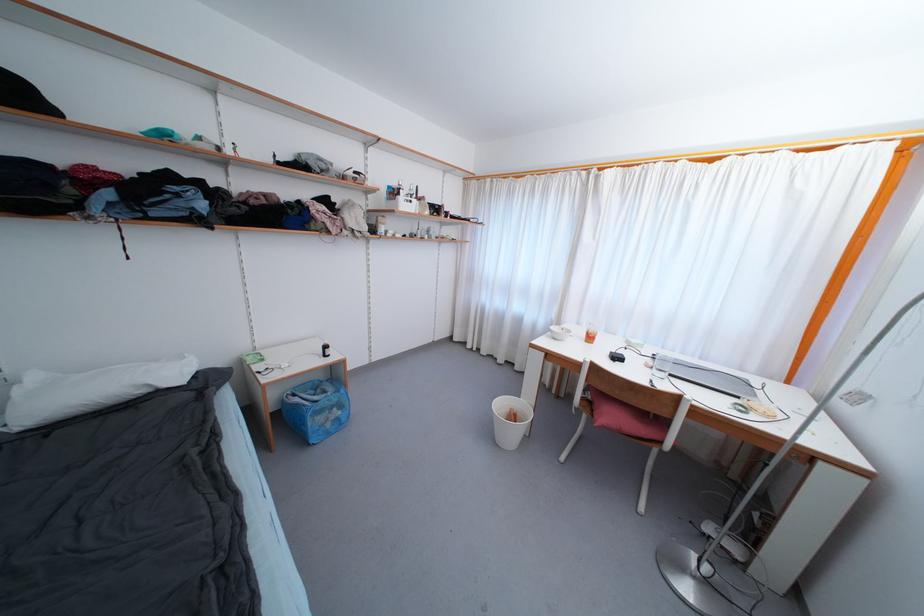
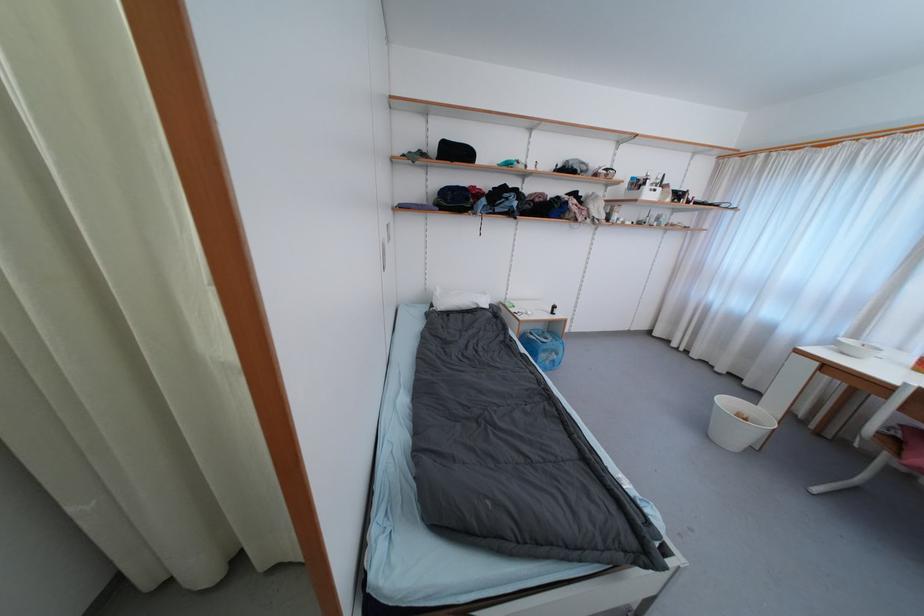
Where in the second image is the point corresponding to the point at 298,398 from the first image?

(535, 336)